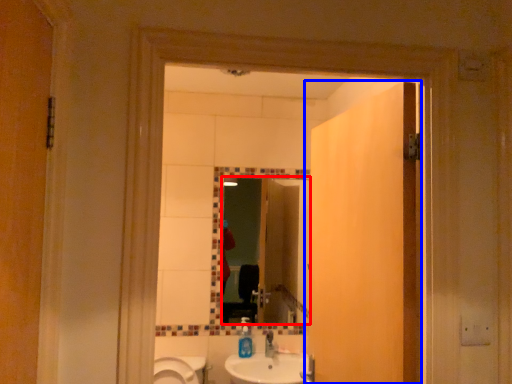
Question: Among these objects, which one is farthest to the camera, mirror (highlighted by a red box) or door (highlighted by a blue box)?

Choices:
 (A) mirror
 (B) door

Answer: (A)